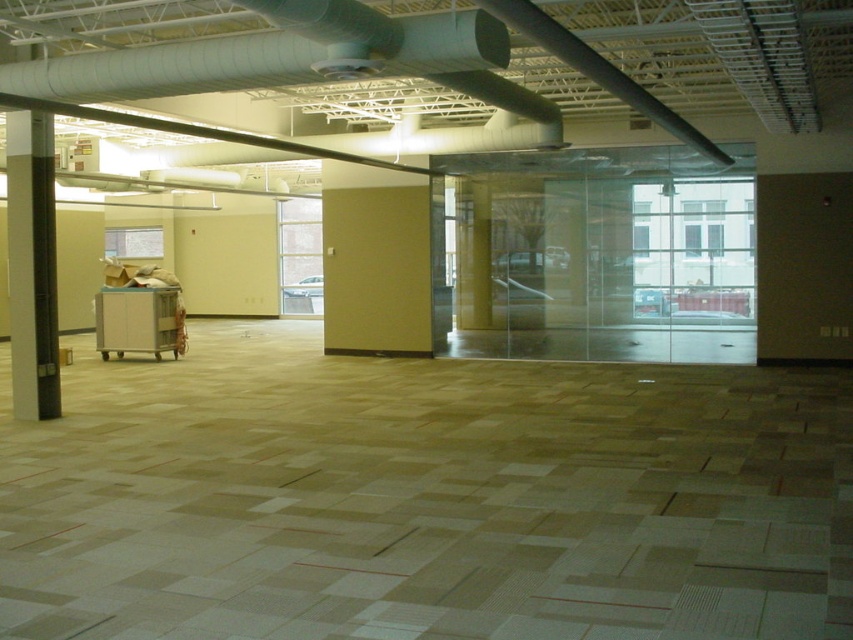
Between beige matte wall at center and white glossy pillar at left, which one appears on the right side from the viewer's perspective?

beige matte wall at center

Can you confirm if beige matte wall at center is positioned to the right of white glossy pillar at left?

Indeed, beige matte wall at center is positioned on the right side of white glossy pillar at left.

Where is `beige matte wall at center`? The width and height of the screenshot is (853, 640). beige matte wall at center is located at coordinates [x=375, y=260].